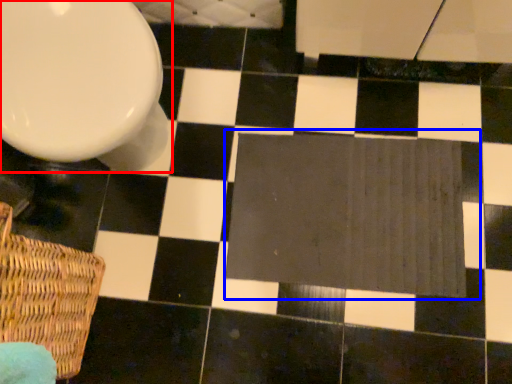
Question: Which point is further to the camera, toilet (highlighted by a red box) or bath mat (highlighted by a blue box)?

Choices:
 (A) toilet
 (B) bath mat

Answer: (B)